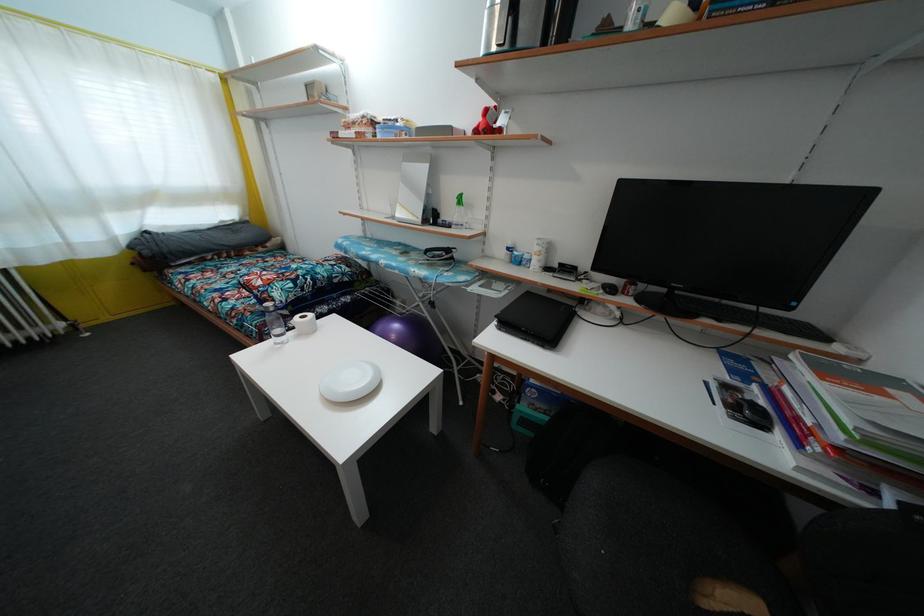
Image resolution: width=924 pixels, height=616 pixels. I want to click on toilet paper roll, so click(x=304, y=323).